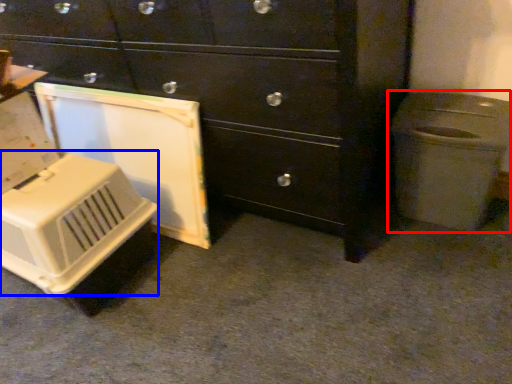
Question: Which point is closer to the camera, waste container (highlighted by a red box) or appliance (highlighted by a blue box)?

Choices:
 (A) waste container
 (B) appliance

Answer: (B)